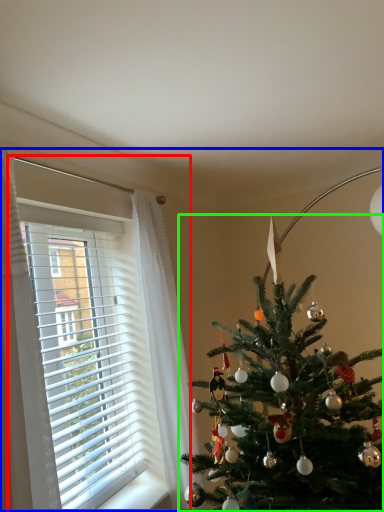
Question: Which object is the closest to the window (highlighted by a red box)? Choose among these: christmas eve (highlighted by a blue box) or christmas tree (highlighted by a green box).

Choices:
 (A) christmas eve
 (B) christmas tree

Answer: (B)